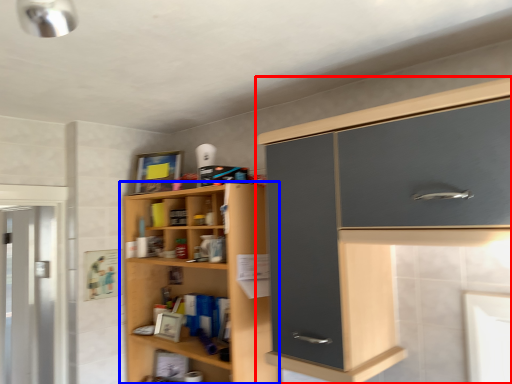
Question: Which point is further to the camera, cabinetry (highlighted by a red box) or cupboard (highlighted by a blue box)?

Choices:
 (A) cabinetry
 (B) cupboard

Answer: (B)